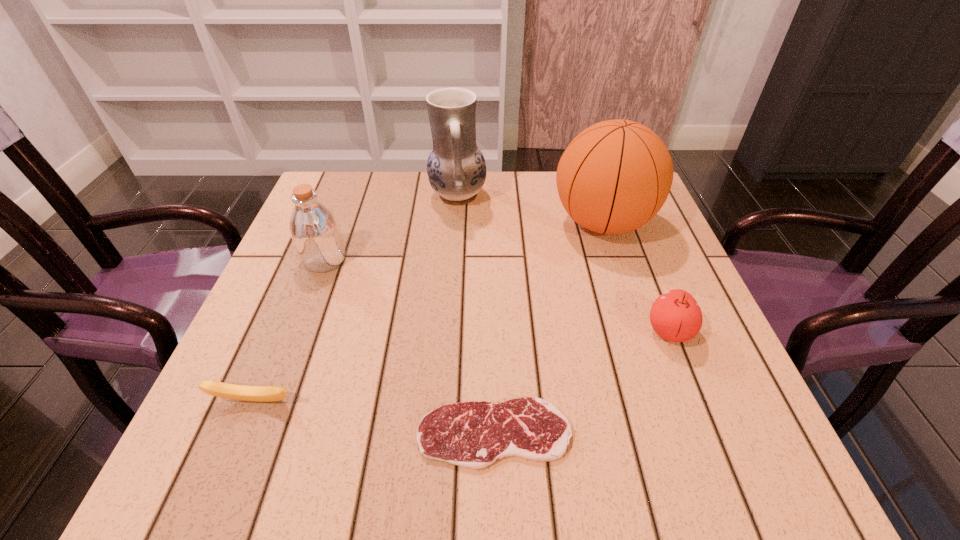
Identify the location of free space in the image that satisfies the following two spatial constraints: 1. at the stem of the shortest object; 2. on the left side of the banana. This screenshot has height=540, width=960. (240, 434).